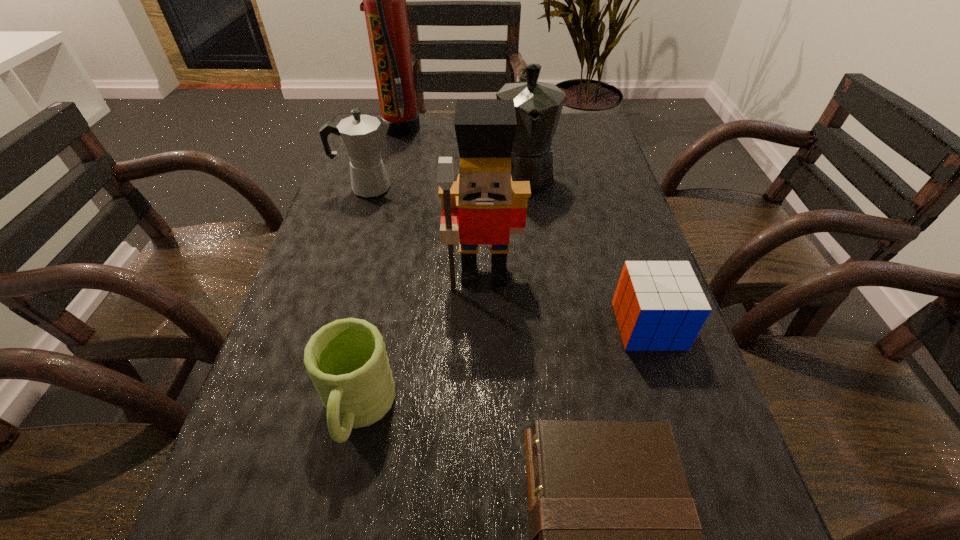
I want to click on fire extinguisher, so click(384, 0).

This screenshot has width=960, height=540. Identify the location of the farthest object. (384, 0).

Where is `the fourth nearest object`? This screenshot has height=540, width=960. the fourth nearest object is located at coordinates (484, 206).

Identify the location of the sixth shortest object. (484, 206).

Locate an element on the screen. the fifth shortest object is located at coordinates (538, 105).

This screenshot has width=960, height=540. I want to click on the taller coffeepot, so click(x=538, y=105).

Locate an element on the screen. The height and width of the screenshot is (540, 960). the left coffeepot is located at coordinates (362, 135).

This screenshot has height=540, width=960. I want to click on the fourth shortest object, so 362,135.

Image resolution: width=960 pixels, height=540 pixels. In order to click on the fifth tallest object in this screenshot , I will do `click(347, 362)`.

The image size is (960, 540). I want to click on the second shortest object, so click(x=659, y=305).